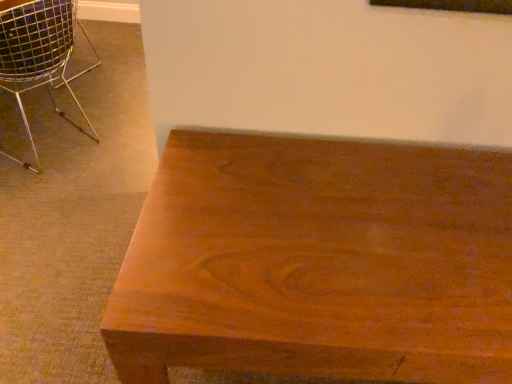
Question: Considering the relative positions of metallic wire chair at left and satin wood table at lower right in the image provided, is metallic wire chair at left in front of satin wood table at lower right?

Choices:
 (A) yes
 (B) no

Answer: (B)

Question: Could you tell me if metallic wire chair at left is turned towards satin wood table at lower right?

Choices:
 (A) no
 (B) yes

Answer: (A)

Question: Is metallic wire chair at left positioned far away from satin wood table at lower right?

Choices:
 (A) yes
 (B) no

Answer: (A)

Question: Is metallic wire chair at left turned away from satin wood table at lower right?

Choices:
 (A) no
 (B) yes

Answer: (B)

Question: Does metallic wire chair at left have a greater width compared to satin wood table at lower right?

Choices:
 (A) no
 (B) yes

Answer: (B)

Question: Is metallic wire chair at left thinner than satin wood table at lower right?

Choices:
 (A) yes
 (B) no

Answer: (B)

Question: Can you confirm if satin wood table at lower right is smaller than metallic wire chair at left?

Choices:
 (A) yes
 (B) no

Answer: (B)

Question: Does satin wood table at lower right lie in front of metallic wire chair at left?

Choices:
 (A) no
 (B) yes

Answer: (B)

Question: Is satin wood table at lower right oriented away from metallic wire chair at left?

Choices:
 (A) yes
 (B) no

Answer: (B)

Question: Is satin wood table at lower right taller than metallic wire chair at left?

Choices:
 (A) yes
 (B) no

Answer: (A)

Question: Is satin wood table at lower right not inside metallic wire chair at left?

Choices:
 (A) yes
 (B) no

Answer: (A)

Question: Is metallic wire chair at left inside satin wood table at lower right?

Choices:
 (A) yes
 (B) no

Answer: (B)

Question: In terms of width, does satin wood table at lower right look wider or thinner when compared to metallic wire chair at left?

Choices:
 (A) thin
 (B) wide

Answer: (A)